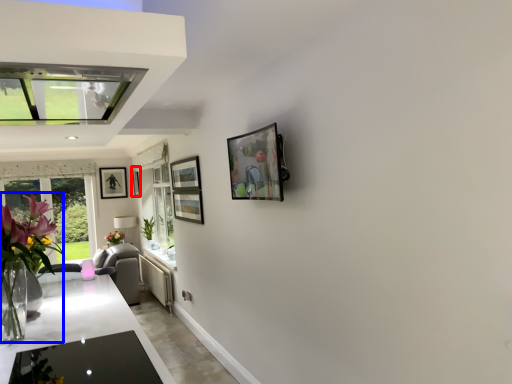
Question: Among these objects, which one is farthest to the camera, picture frame (highlighted by a red box) or floral arrangement (highlighted by a blue box)?

Choices:
 (A) picture frame
 (B) floral arrangement

Answer: (A)